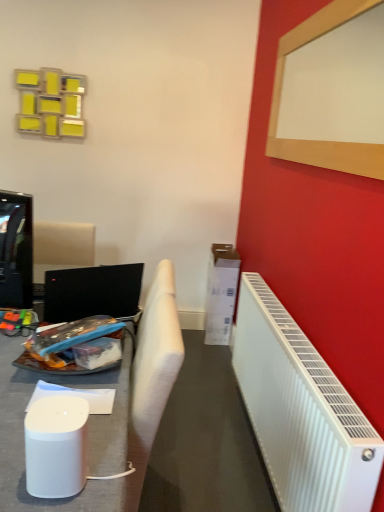
Question: Would you say wooden frame at upper right is to the left or to the right of white fabric chair at left in the picture?

Choices:
 (A) left
 (B) right

Answer: (B)

Question: Is wooden frame at upper right spatially inside white fabric chair at left, or outside of it?

Choices:
 (A) inside
 (B) outside

Answer: (B)

Question: Estimate the real-world distances between objects in this image. Which object is farther from the black glossy laptop at left?

Choices:
 (A) white fabric chair at left
 (B) black glossy television at left
 (C) wooden frame at upper right
 (D) white plastic radiator at right

Answer: (C)

Question: Considering the real-world distances, which object is farthest from the black glossy television at left?

Choices:
 (A) wooden frame at upper right
 (B) white fabric chair at left
 (C) white plastic radiator at right
 (D) black glossy laptop at left

Answer: (A)